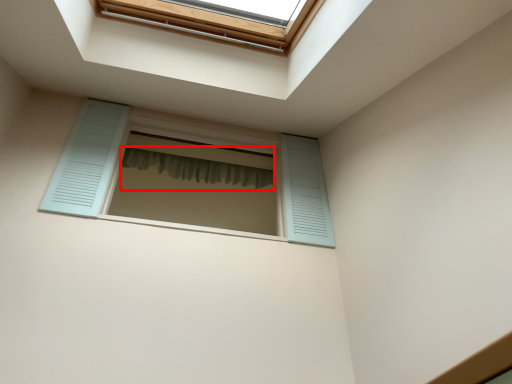
Question: Observing the image, what is the correct spatial positioning of shower curtain (annotated by the red box) in reference to window?

Choices:
 (A) right
 (B) left

Answer: (B)